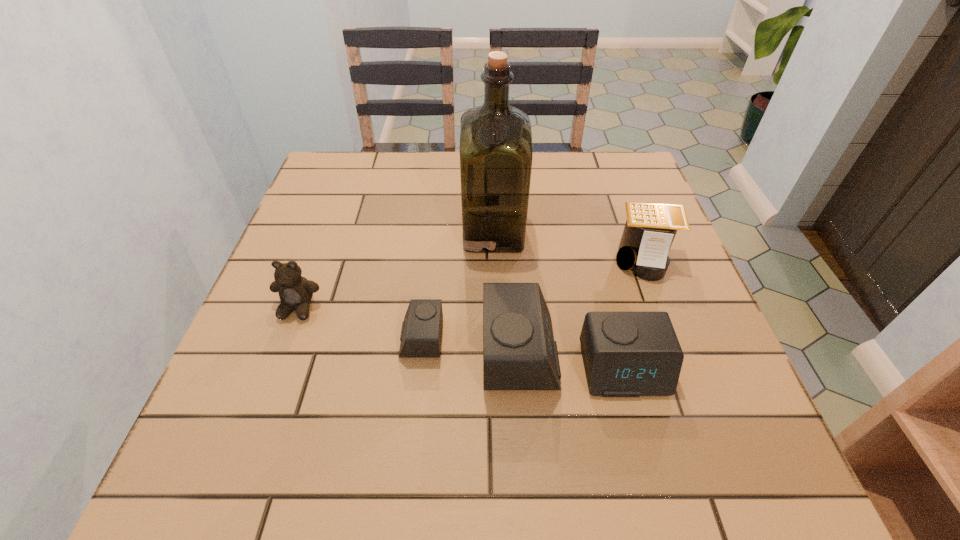
The image size is (960, 540). What are the coordinates of `the leftmost alarm clock` in the screenshot? It's located at (421, 333).

Locate an element on the screen. The height and width of the screenshot is (540, 960). the fifth object from right to left is located at coordinates (421, 333).

What are the coordinates of `the second alarm clock from left to right` in the screenshot? It's located at (519, 352).

The height and width of the screenshot is (540, 960). What are the coordinates of `the second shortest object` in the screenshot? It's located at (626, 354).

This screenshot has height=540, width=960. What are the coordinates of `the second shortest alarm clock` in the screenshot? It's located at (626, 354).

The width and height of the screenshot is (960, 540). Identify the location of calculator. (650, 228).

Image resolution: width=960 pixels, height=540 pixels. What are the coordinates of `the tallest object` in the screenshot? It's located at (496, 153).

Locate an element on the screen. Image resolution: width=960 pixels, height=540 pixels. teddy bear is located at coordinates (295, 292).

Where is `vacant region located 0.090m on the front-facing side of the second object from left to right`? The image size is (960, 540). vacant region located 0.090m on the front-facing side of the second object from left to right is located at coordinates point(355,339).

You are a GUI agent. You are given a task and a screenshot of the screen. Output one action in this format:
    pyautogui.click(x=<x>, y=<y>)
    Task: Click on the vacant space located 0.150m on the front-facing side of the second object from left to right
    This screenshot has height=540, width=960.
    Given the screenshot: What is the action you would take?
    pyautogui.click(x=324, y=339)